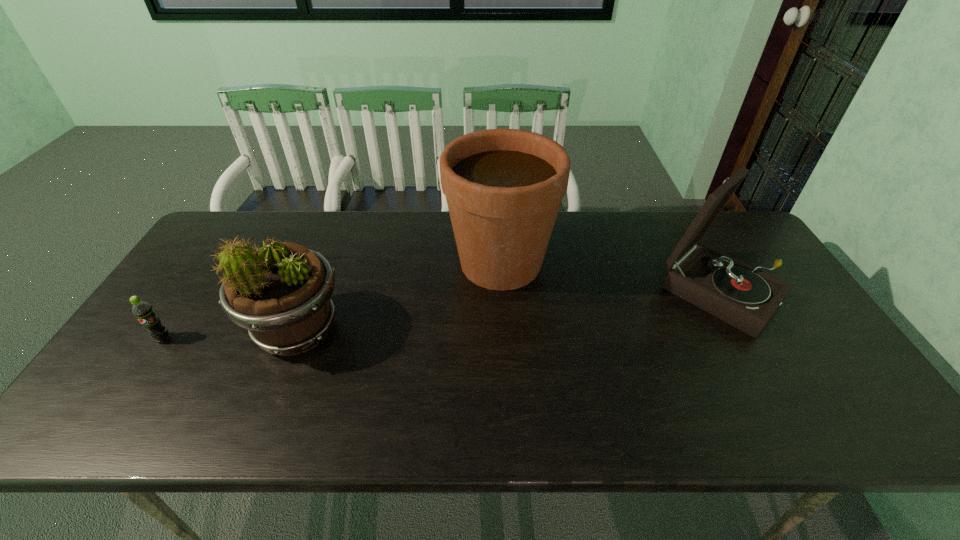
Locate an element on the screen. Image resolution: width=960 pixels, height=540 pixels. phonograph record at the far edge is located at coordinates (729, 289).

At what (x,y) coordinates should I click in order to perform the action: click on object at the left edge. Please return your answer as a coordinate pair (x, y). The image size is (960, 540). Looking at the image, I should click on (143, 311).

The width and height of the screenshot is (960, 540). I want to click on object that is positioned at the right edge, so click(729, 289).

This screenshot has width=960, height=540. In order to click on object present at the far right corner in this screenshot , I will do click(x=729, y=289).

In order to click on vacant space at the far edge in this screenshot , I will do `click(410, 212)`.

At what (x,y) coordinates should I click in order to perform the action: click on vacant area at the near edge. Please return your answer as a coordinate pair (x, y). Looking at the image, I should click on (365, 410).

The width and height of the screenshot is (960, 540). Identify the location of free space at the left edge of the desktop. (197, 261).

You are a GUI agent. You are given a task and a screenshot of the screen. Output one action in this format:
    pyautogui.click(x=<x>, y=<y>)
    Task: Click on the blank area at the right edge
    This screenshot has width=960, height=540.
    Given the screenshot: What is the action you would take?
    pyautogui.click(x=801, y=314)

The height and width of the screenshot is (540, 960). In order to click on vacant space at the far left corner of the desktop in this screenshot , I will do [x=205, y=255].

Find the location of `empty location between the phonograph record and the third object from left to right`. empty location between the phonograph record and the third object from left to right is located at coordinates [612, 278].